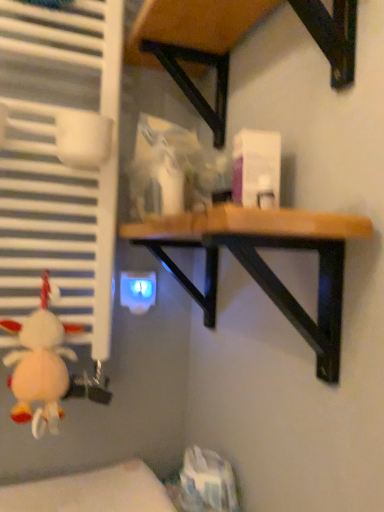
Question: Can you confirm if wooden table at upper center, placed as the 1th table when sorted from top to bottom, is smaller than wooden table at center, which is the first table in bottom-to-top order?

Choices:
 (A) no
 (B) yes

Answer: (B)

Question: Is wooden table at center, which is the first table in bottom-to-top order, at the back of wooden table at upper center, placed as the 1th table when sorted from top to bottom?

Choices:
 (A) yes
 (B) no

Answer: (B)

Question: From the image's perspective, is wooden table at upper center, placed as the 1th table when sorted from top to bottom, located above wooden table at center, which is the first table in bottom-to-top order?

Choices:
 (A) no
 (B) yes

Answer: (B)

Question: Considering the relative positions of wooden table at upper center, which is the 2th table in bottom-to-top order, and wooden table at center, which is the first table in bottom-to-top order, in the image provided, is wooden table at upper center, which is the 2th table in bottom-to-top order, behind wooden table at center, which is the first table in bottom-to-top order,?

Choices:
 (A) yes
 (B) no

Answer: (B)

Question: From a real-world perspective, is wooden table at upper center, which is the 2th table in bottom-to-top order, physically above wooden table at center, which is the first table in bottom-to-top order?

Choices:
 (A) yes
 (B) no

Answer: (A)

Question: Relative to blue glossy electric outlet at lower center, is fluffy white plush at lower left in front or behind?

Choices:
 (A) behind
 (B) front

Answer: (B)

Question: From a real-world perspective, relative to blue glossy electric outlet at lower center, is fluffy white plush at lower left vertically above or below?

Choices:
 (A) above
 (B) below

Answer: (B)

Question: Is fluffy white plush at lower left spatially inside blue glossy electric outlet at lower center, or outside of it?

Choices:
 (A) outside
 (B) inside

Answer: (A)

Question: Is point (41, 368) positioned closer to the camera than point (135, 312)?

Choices:
 (A) farther
 (B) closer

Answer: (B)

Question: Is fluffy white plush at lower left to the left or to the right of wooden table at center, which is the second table in top-to-bottom order, in the image?

Choices:
 (A) right
 (B) left

Answer: (B)

Question: From a real-world perspective, is fluffy white plush at lower left physically located above or below wooden table at center, which is the second table in top-to-bottom order?

Choices:
 (A) above
 (B) below

Answer: (B)

Question: Is point (54, 414) positioned closer to the camera than point (331, 285)?

Choices:
 (A) closer
 (B) farther

Answer: (B)

Question: Do you think fluffy white plush at lower left is within wooden table at center, which is the first table in bottom-to-top order, or outside of it?

Choices:
 (A) inside
 (B) outside

Answer: (B)

Question: In terms of width, does wooden table at upper center, placed as the 1th table when sorted from top to bottom, look wider or thinner when compared to wooden table at center, which is the first table in bottom-to-top order?

Choices:
 (A) thin
 (B) wide

Answer: (B)

Question: From the image's perspective, is wooden table at upper center, which is the 2th table in bottom-to-top order, above or below wooden table at center, which is the first table in bottom-to-top order?

Choices:
 (A) above
 (B) below

Answer: (A)